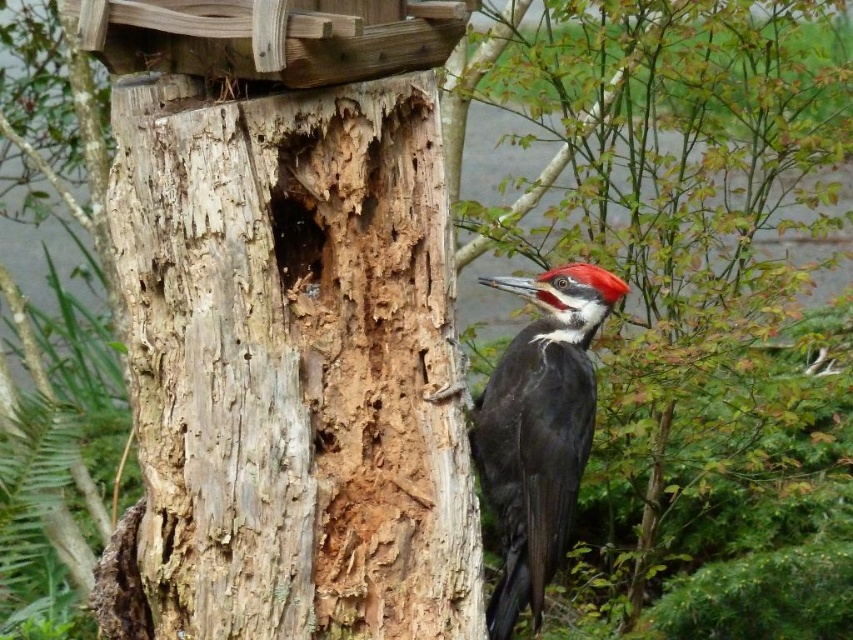
Between point (527, 566) and point (294, 236), which one is positioned in front?

Positioned in front is point (294, 236).

Which is more to the right, black glossy woodpecker at center or brown rough wood at center?

black glossy woodpecker at center

Identify the location of black glossy woodpecker at center. (538, 429).

Image resolution: width=853 pixels, height=640 pixels. Find the location of `black glossy woodpecker at center`. black glossy woodpecker at center is located at coordinates (538, 429).

Does weathered wood tree trunk at center lie in front of black glossy woodpecker at center?

Yes, weathered wood tree trunk at center is in front of black glossy woodpecker at center.

You are a GUI agent. You are given a task and a screenshot of the screen. Output one action in this format:
    pyautogui.click(x=<x>, y=<y>)
    Task: Click on the weathered wood tree trunk at center
    The image size is (853, 640).
    Given the screenshot: What is the action you would take?
    pyautogui.click(x=291, y=369)

Who is more distant from viewer, [236,205] or [534,289]?

Point [534,289]

This screenshot has height=640, width=853. Find the location of `weathered wood tree trunk at center`. weathered wood tree trunk at center is located at coordinates (291, 369).

Is smooth bark tree trunk at center closer to the viewer compared to brown rough wood at center?

No, it is not.

Who is positioned more to the left, smooth bark tree trunk at center or brown rough wood at center?

brown rough wood at center

Is point (677, 109) positioned after point (294, 228)?

Yes, point (677, 109) is farther from viewer.

You are a GUI agent. You are given a task and a screenshot of the screen. Output one action in this format:
    pyautogui.click(x=<x>, y=<y>)
    Task: Click on the smooth bark tree trunk at center
    The height and width of the screenshot is (640, 853).
    Given the screenshot: What is the action you would take?
    pyautogui.click(x=670, y=193)